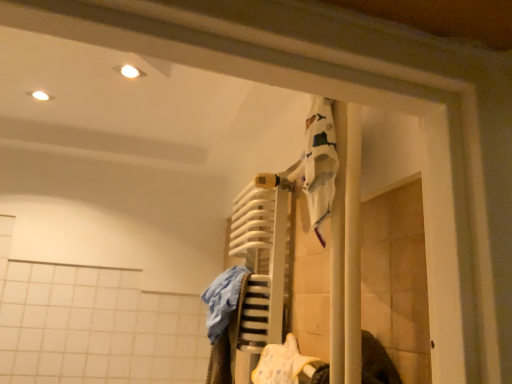
Question: From the image's perspective, is yellow fabric at lower center, which is the second clothing from left to right, positioned above or below blue cotton towel at center, acting as the second clothing starting from the right?

Choices:
 (A) above
 (B) below

Answer: (B)

Question: In the image, is yellow fabric at lower center, the first clothing when ordered from right to left, on the left side or the right side of blue cotton towel at center, which appears as the 1th clothing when viewed from the left?

Choices:
 (A) left
 (B) right

Answer: (B)

Question: Which is correct: yellow fabric at lower center, which is the second clothing from left to right, is inside blue cotton towel at center, which appears as the 1th clothing when viewed from the left, or outside of it?

Choices:
 (A) inside
 (B) outside

Answer: (B)

Question: Looking at the image, does blue cotton towel at center, which appears as the 1th clothing when viewed from the left, seem bigger or smaller compared to yellow fabric at lower center, which is the second clothing from left to right?

Choices:
 (A) small
 (B) big

Answer: (B)

Question: Considering the positions of blue cotton towel at center, acting as the second clothing starting from the right, and yellow fabric at lower center, the first clothing when ordered from right to left, in the image, is blue cotton towel at center, acting as the second clothing starting from the right, wider or thinner than yellow fabric at lower center, the first clothing when ordered from right to left,?

Choices:
 (A) thin
 (B) wide

Answer: (B)

Question: Is blue cotton towel at center, acting as the second clothing starting from the right, in front of or behind yellow fabric at lower center, the first clothing when ordered from right to left, in the image?

Choices:
 (A) behind
 (B) front

Answer: (A)

Question: Considering the positions of point (224, 367) and point (269, 350), is point (224, 367) closer or farther from the camera than point (269, 350)?

Choices:
 (A) closer
 (B) farther

Answer: (B)